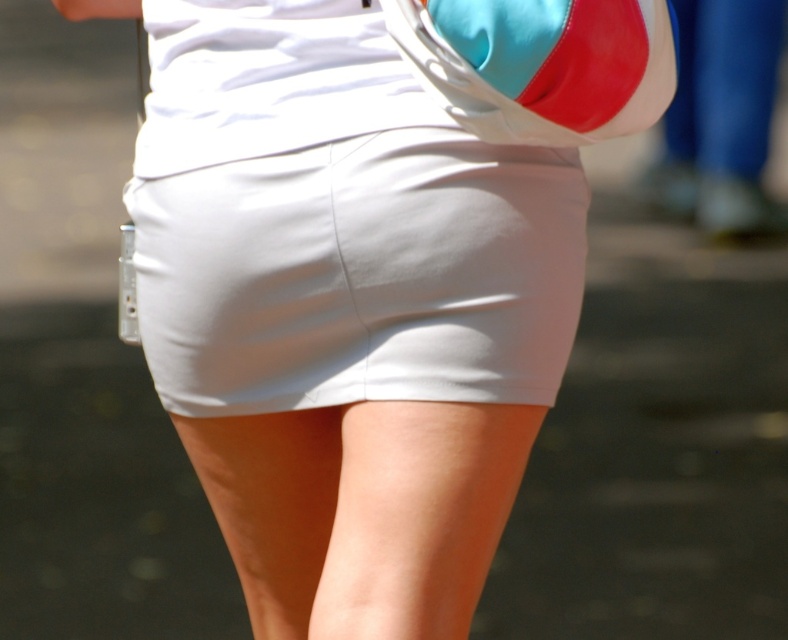
Who is higher up, white smooth shorts at center or satin-like turquoise and red shoulder bag at upper center?

satin-like turquoise and red shoulder bag at upper center is higher up.

Consider the image. Is white smooth shorts at center in front of satin-like turquoise and red shoulder bag at upper center?

No, it is behind satin-like turquoise and red shoulder bag at upper center.

Does point (415, 342) lie behind point (567, 140)?

That is True.

Find the location of a particular element. This screenshot has width=788, height=640. white smooth shorts at center is located at coordinates (361, 275).